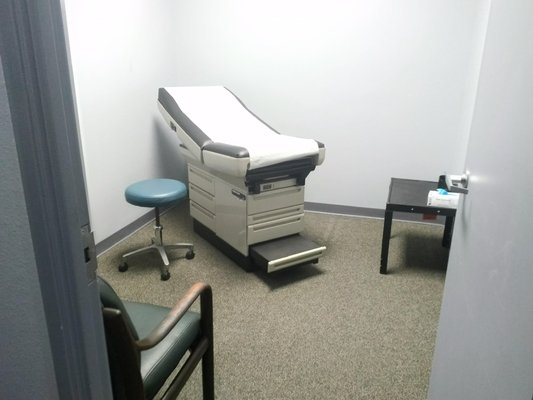
Identify the location of grey industrial carpet. (298, 345).